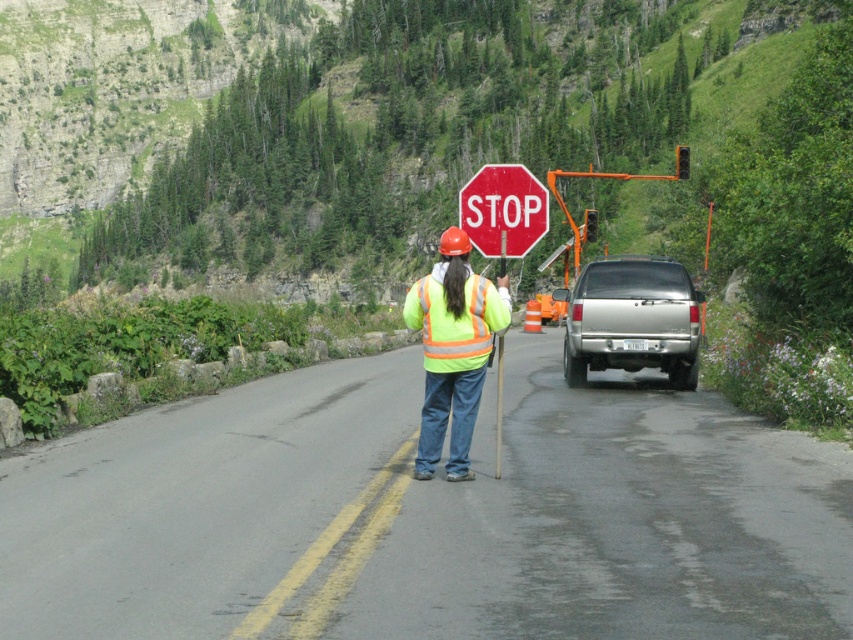
Is high-visibility reflective vest at center wider than high-visibility fabric safety vest at center?

No, high-visibility reflective vest at center is not wider than high-visibility fabric safety vest at center.

The image size is (853, 640). What do you see at coordinates (453, 349) in the screenshot?
I see `high-visibility reflective vest at center` at bounding box center [453, 349].

The width and height of the screenshot is (853, 640). I want to click on high-visibility reflective vest at center, so click(453, 349).

Between silver metallic suv at center and red matte stop sign at center, which one is positioned higher?

Positioned higher is red matte stop sign at center.

Which is behind, point (682, 332) or point (531, 212)?

Point (682, 332)

You are a GUI agent. You are given a task and a screenshot of the screen. Output one action in this format:
    pyautogui.click(x=<x>, y=<y>)
    Task: Click on the silver metallic suv at center
    Image resolution: width=853 pixels, height=640 pixels.
    Given the screenshot: What is the action you would take?
    pyautogui.click(x=631, y=320)

Is point (379, 579) closer to camera compared to point (471, 321)?

Yes, it is.

Between reflective yellow safety vest at center and high-visibility fabric safety vest at center, which one appears on the left side from the viewer's perspective?

high-visibility fabric safety vest at center

Describe the element at coordinates (616, 522) in the screenshot. I see `reflective yellow safety vest at center` at that location.

Locate an element on the screen. The width and height of the screenshot is (853, 640). reflective yellow safety vest at center is located at coordinates (616, 522).